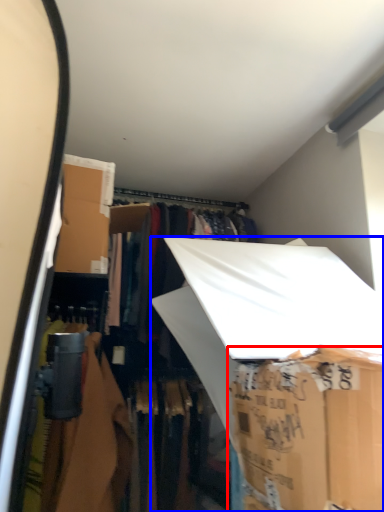
Question: Which point is further to the camera, storage box (highlighted by a red box) or storage box (highlighted by a blue box)?

Choices:
 (A) storage box
 (B) storage box

Answer: (B)